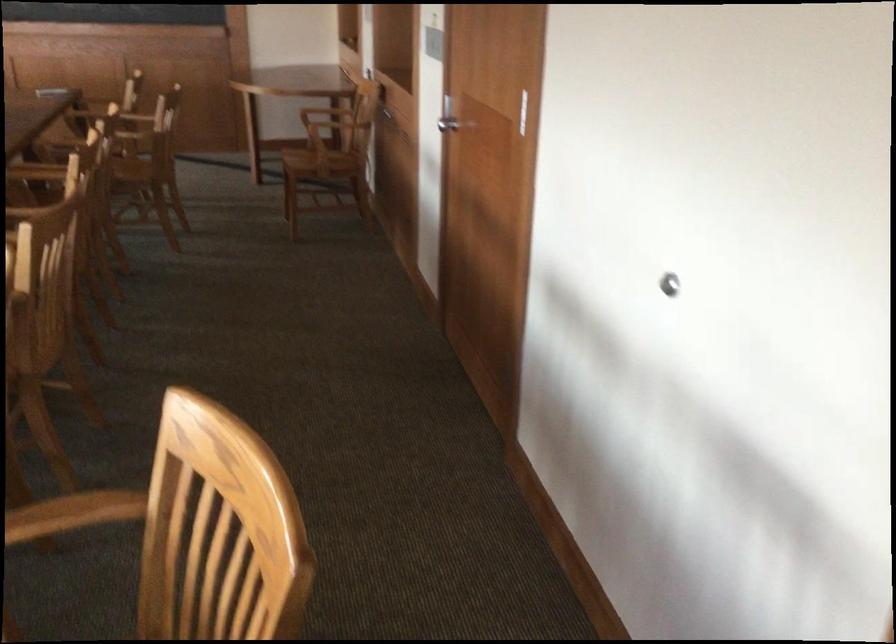
The width and height of the screenshot is (896, 644). In order to click on silver door handle in this screenshot , I will do `click(448, 124)`.